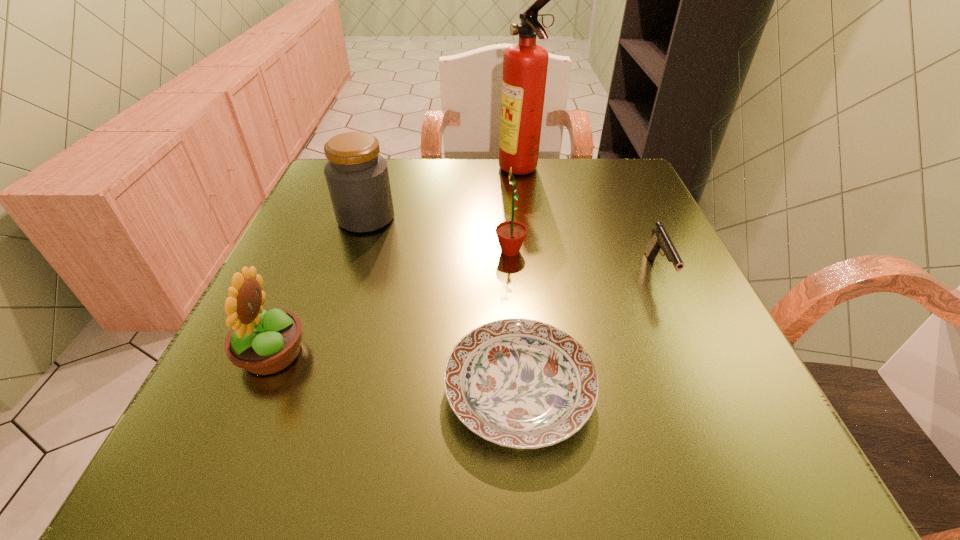
This screenshot has width=960, height=540. In order to click on object at the near edge in this screenshot , I will do `click(520, 383)`.

This screenshot has width=960, height=540. In order to click on jar located at the left edge in this screenshot , I will do `click(357, 177)`.

What are the coordinates of `sunflower positioned at the left edge` in the screenshot? It's located at (264, 342).

Where is `object that is positioned at the right edge`? object that is positioned at the right edge is located at coordinates (660, 240).

Find the location of a particular element. The width and height of the screenshot is (960, 540). object located at the far left corner is located at coordinates (357, 177).

The height and width of the screenshot is (540, 960). Find the location of `free space at the far edge of the desktop`. free space at the far edge of the desktop is located at coordinates (412, 195).

Find the location of a particular element. This screenshot has width=960, height=540. free region at the near edge of the desktop is located at coordinates (454, 451).

This screenshot has height=540, width=960. I want to click on vacant space at the left edge of the desktop, so click(x=309, y=273).

Image resolution: width=960 pixels, height=540 pixels. I want to click on blank space at the right edge of the desktop, so click(670, 289).

In the image, there is a desktop. Where is `vacant space at the near right corner`? This screenshot has width=960, height=540. vacant space at the near right corner is located at coordinates (780, 484).